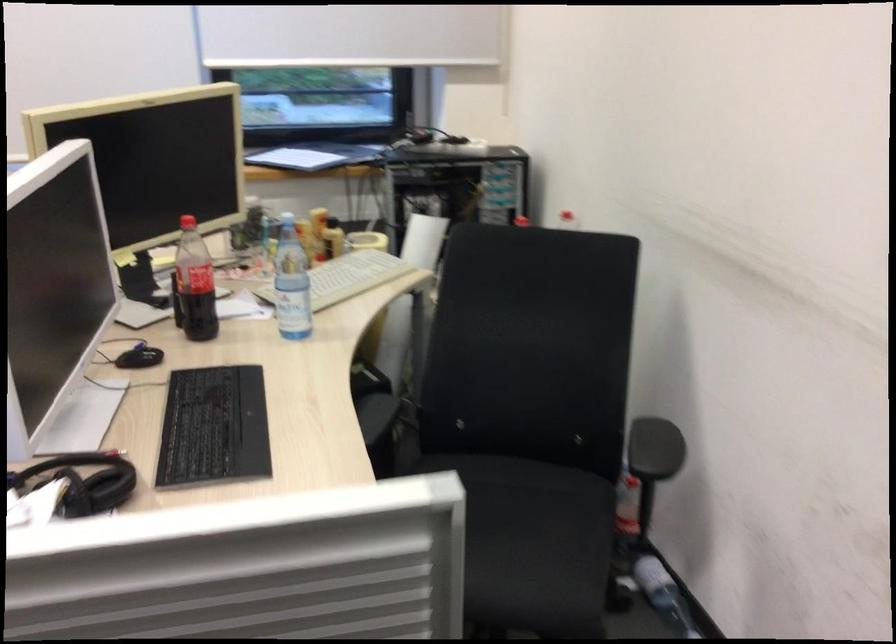
Where would you resting arm the chair armrest? Please return your answer as a coordinate pair (x, y).

(655, 449)